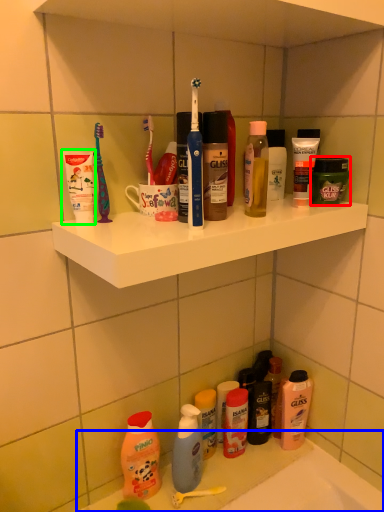
Question: Which object is positioned farthest from toiletry (highlighted by a red box)? Select from counter (highlighted by a blue box) and toiletry (highlighted by a green box).

Choices:
 (A) counter
 (B) toiletry

Answer: (A)